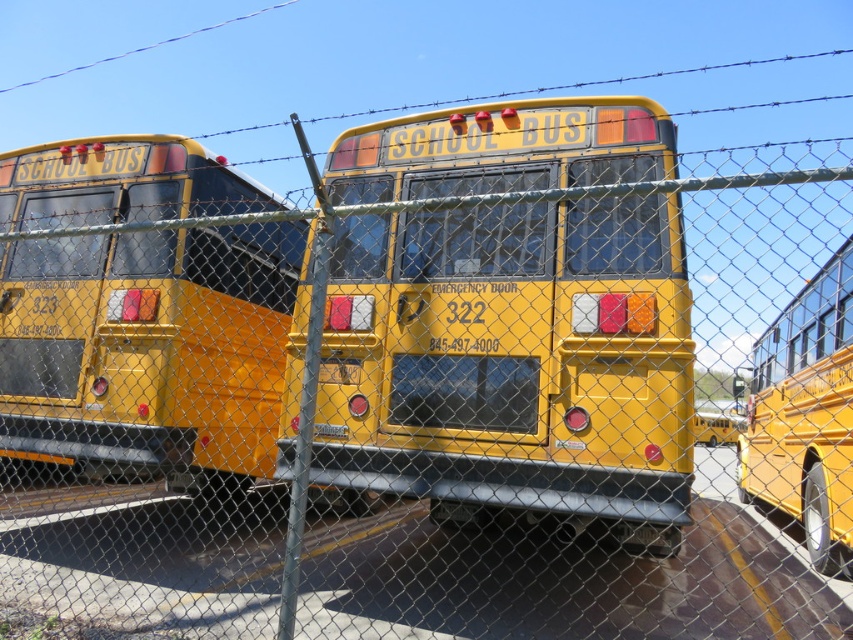
Question: Which object is closer to the camera taking this photo?

Choices:
 (A) matte yellow school bus at left
 (B) yellow matte school bus at center
 (C) matte yellow school bus at right

Answer: (B)

Question: Which object is closer to the camera taking this photo?

Choices:
 (A) matte yellow school bus at left
 (B) matte yellow school bus at right
 (C) yellow matte school bus at center

Answer: (C)

Question: Is yellow matte school bus at center bigger than matte yellow school bus at left?

Choices:
 (A) no
 (B) yes

Answer: (A)

Question: Does yellow matte school bus at center lie in front of matte yellow school bus at right?

Choices:
 (A) no
 (B) yes

Answer: (B)

Question: Which of the following is the closest to the observer?

Choices:
 (A) matte yellow school bus at right
 (B) yellow matte school bus at center
 (C) matte yellow school bus at left

Answer: (B)

Question: Is yellow matte school bus at center wider than matte yellow school bus at left?

Choices:
 (A) yes
 (B) no

Answer: (A)